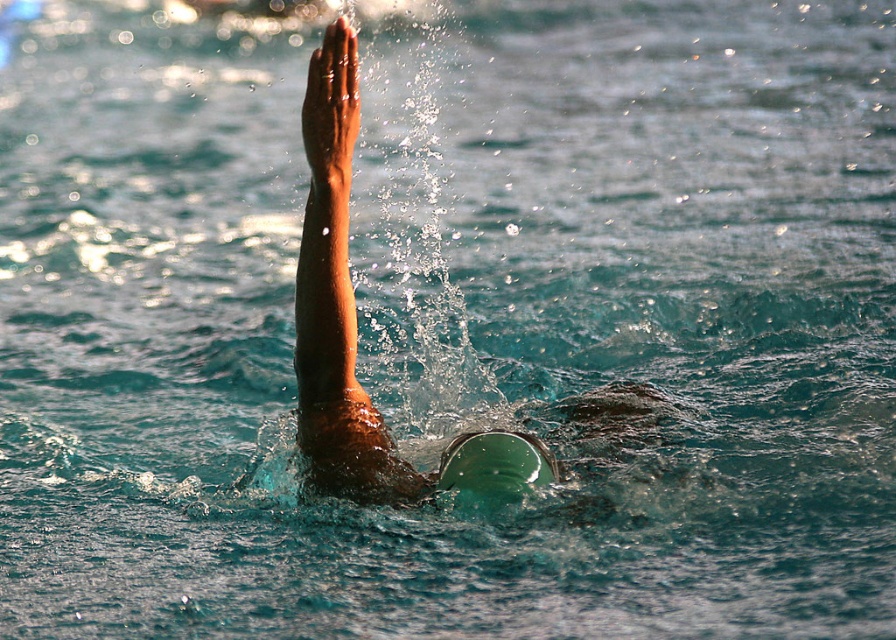
Question: Can you confirm if clear water splash at upper center is thinner than matte skin at center?

Choices:
 (A) yes
 (B) no

Answer: (B)

Question: Which object is closer to the camera taking this photo?

Choices:
 (A) green rubber swim cap at center
 (B) matte skin at center

Answer: (B)

Question: Which object is closer to the camera taking this photo?

Choices:
 (A) green rubber swim cap at center
 (B) clear water splash at upper center

Answer: (A)

Question: Does clear water splash at upper center appear on the left side of green rubber swim cap at center?

Choices:
 (A) no
 (B) yes

Answer: (B)

Question: Estimate the real-world distances between objects in this image. Which object is farther from the matte skin at center?

Choices:
 (A) clear water splash at upper center
 (B) green rubber swim cap at center

Answer: (A)

Question: Does matte skin at center appear on the left side of green rubber swim cap at center?

Choices:
 (A) yes
 (B) no

Answer: (A)